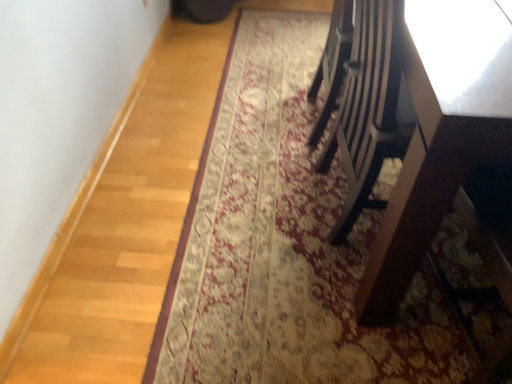
What do you see at coordinates (410, 124) in the screenshot? This screenshot has width=512, height=384. I see `wooden chair at right` at bounding box center [410, 124].

Locate an element on the screen. wooden chair at right is located at coordinates click(410, 124).

This screenshot has width=512, height=384. I want to click on wooden chair at right, so click(x=410, y=124).